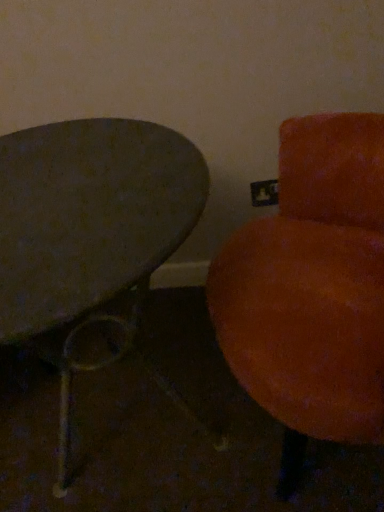
What do you see at coordinates (89, 233) in the screenshot? I see `metallic gray table at left` at bounding box center [89, 233].

Where is `metallic gray table at left`? metallic gray table at left is located at coordinates (89, 233).

Image resolution: width=384 pixels, height=512 pixels. Describe the element at coordinates (312, 289) in the screenshot. I see `velvet orange chair at right` at that location.

Find the location of `velvet orange chair at right`. velvet orange chair at right is located at coordinates (312, 289).

The width and height of the screenshot is (384, 512). In order to click on metallic gray table at left in this screenshot , I will do `click(89, 233)`.

Is velvet orange chair at right at the right side of metallic gray table at left?

Yes.

Is velvet orange chair at right positioned behind metallic gray table at left?

No, the depth of velvet orange chair at right is less than that of metallic gray table at left.

Which is in front, point (349, 253) or point (190, 152)?

The point (190, 152) is closer to the camera.

From the image's perspective, is velvet orange chair at right positioned above or below metallic gray table at left?

Clearly, from the image's perspective, velvet orange chair at right is above metallic gray table at left.

From a real-world perspective, is velvet orange chair at right positioned over metallic gray table at left based on gravity?

Yes.

Does velvet orange chair at right have a greater width compared to metallic gray table at left?

In fact, velvet orange chair at right might be narrower than metallic gray table at left.

Can you confirm if velvet orange chair at right is shorter than metallic gray table at left?

No.

Between velvet orange chair at right and metallic gray table at left, which one has larger size?

Bigger between the two is velvet orange chair at right.

Is velvet orange chair at right inside or outside of metallic gray table at left?

The correct answer is: outside.

Is velvet orange chair at right not near metallic gray table at left?

They are positioned close to each other.

Is metallic gray table at left at the back of velvet orange chair at right?

velvet orange chair at right does not have its back to metallic gray table at left.

How different are the orientations of velvet orange chair at right and metallic gray table at left in degrees?

The angular difference between velvet orange chair at right and metallic gray table at left is 78.9 degrees.

Find the location of `table below the velvet orange chair at right (from a real-world perspective)`. table below the velvet orange chair at right (from a real-world perspective) is located at coordinates [x=89, y=233].

Is metallic gray table at left to the left of velvet orange chair at right from the viewer's perspective?

Correct, you'll find metallic gray table at left to the left of velvet orange chair at right.

Looking at this image, relative to velvet orange chair at right, is metallic gray table at left in front or behind?

Clearly, metallic gray table at left is behind velvet orange chair at right.

Is point (162, 222) in front of point (236, 286)?

Yes, point (162, 222) is in front of point (236, 286).

From the image's perspective, does metallic gray table at left appear higher than velvet orange chair at right?

No, from the image's perspective, metallic gray table at left is not on top of velvet orange chair at right.

From a real-world perspective, who is located higher, metallic gray table at left or velvet orange chair at right?

velvet orange chair at right is physically above.

Which of these two, metallic gray table at left or velvet orange chair at right, is thinner?

velvet orange chair at right.

Who is taller, metallic gray table at left or velvet orange chair at right?

Standing taller between the two is velvet orange chair at right.

Based on the photo, is metallic gray table at left bigger than velvet orange chair at right?

No.

Can we say metallic gray table at left lies outside velvet orange chair at right?

That's correct, metallic gray table at left is outside of velvet orange chair at right.

Is metallic gray table at left not near velvet orange chair at right?

metallic gray table at left is actually quite close to velvet orange chair at right.

Is metallic gray table at left positioned with its back to velvet orange chair at right?

metallic gray table at left does not have its back to velvet orange chair at right.

Identify the location of table that is behind the velvet orange chair at right. (89, 233).

Where is `chair lying above the metallic gray table at left (from the image's perspective)`? The height and width of the screenshot is (512, 384). chair lying above the metallic gray table at left (from the image's perspective) is located at coordinates (312, 289).

This screenshot has height=512, width=384. What are the coordinates of `chair above the metallic gray table at left (from a real-world perspective)` in the screenshot? It's located at (312, 289).